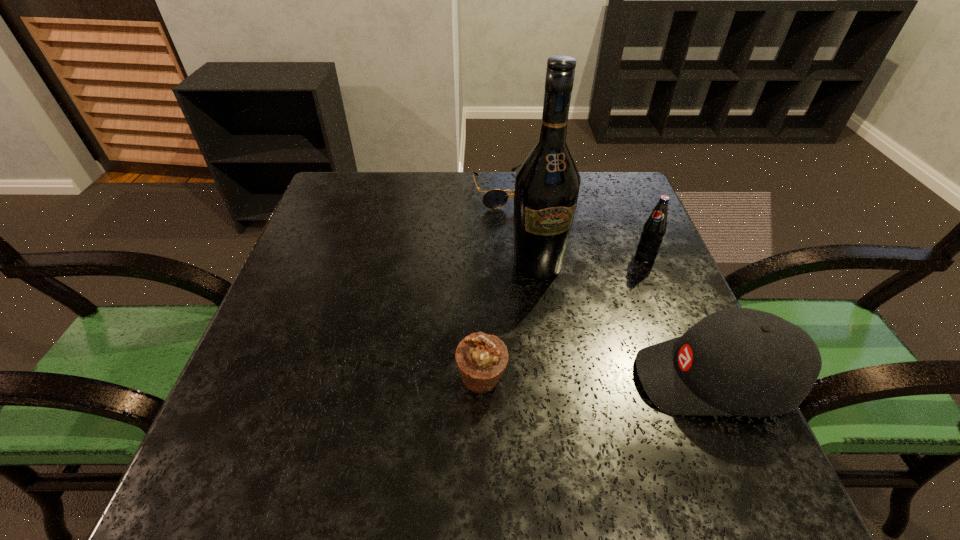
At what (x,y) coordinates should I click in order to perform the action: click on free space on the desktop that is between the muffin and the baseball cap and is positioned on the lenses of the shortest object. Please return your answer as a coordinate pair (x, y). Image resolution: width=960 pixels, height=540 pixels. Looking at the image, I should click on (601, 379).

Find the location of a particular element. The image size is (960, 540). free space on the desktop that is between the muffin and the baseball cap and is positioned on the label of the wine bottle is located at coordinates (586, 379).

You are a GUI agent. You are given a task and a screenshot of the screen. Output one action in this format:
    pyautogui.click(x=<x>, y=<y>)
    Task: Click on the vacant space on the desktop that is between the muffin and the baseball cap and is positioned on the front label of the pop
    This screenshot has height=540, width=960.
    Given the screenshot: What is the action you would take?
    pyautogui.click(x=577, y=379)